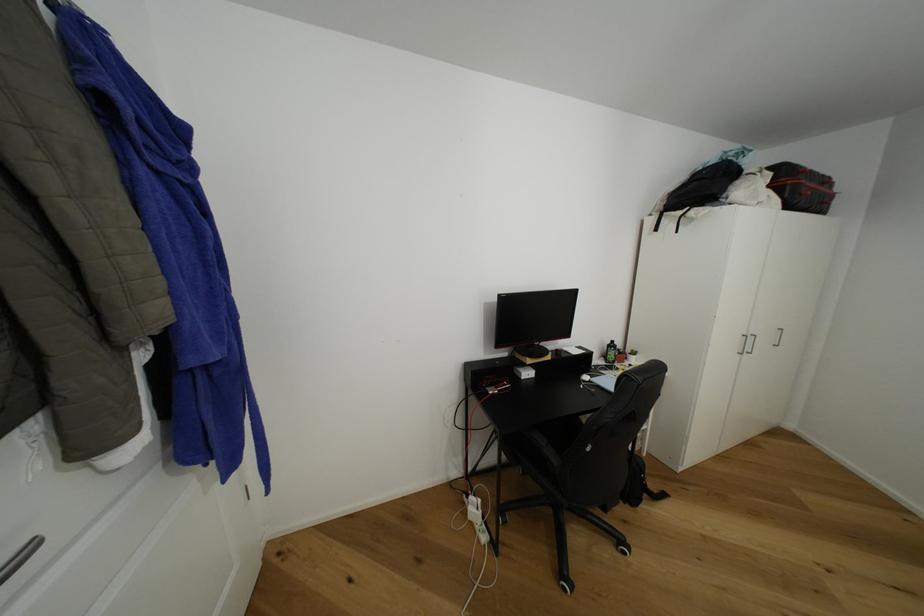
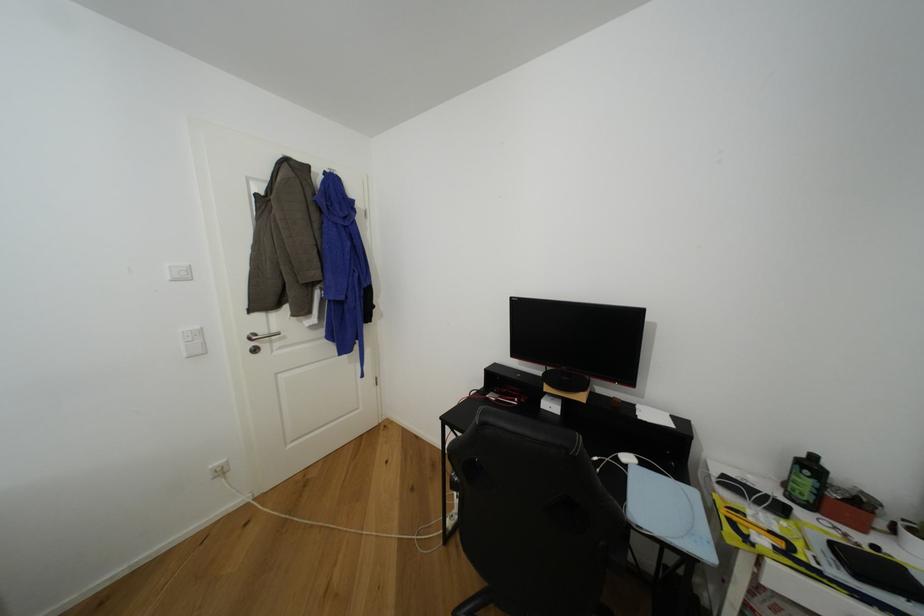
Locate, in the second image, the point that corresponds to (617,342) in the first image.

(820, 459)